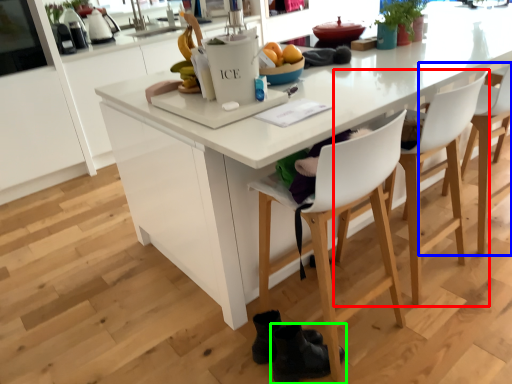
Question: Which is farther away from chair (highlighted by a red box)? chair (highlighted by a blue box) or footwear (highlighted by a green box)?

Choices:
 (A) chair
 (B) footwear

Answer: (B)